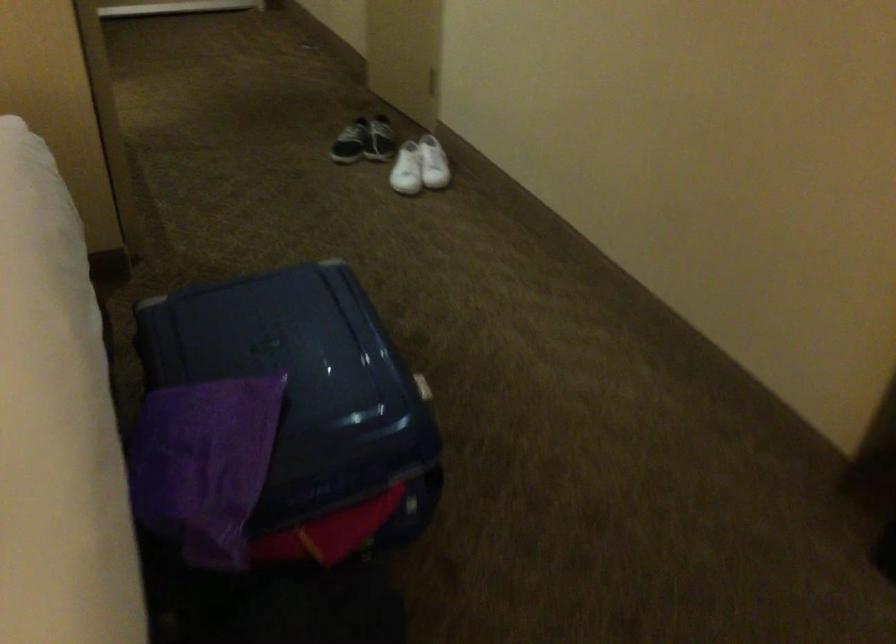
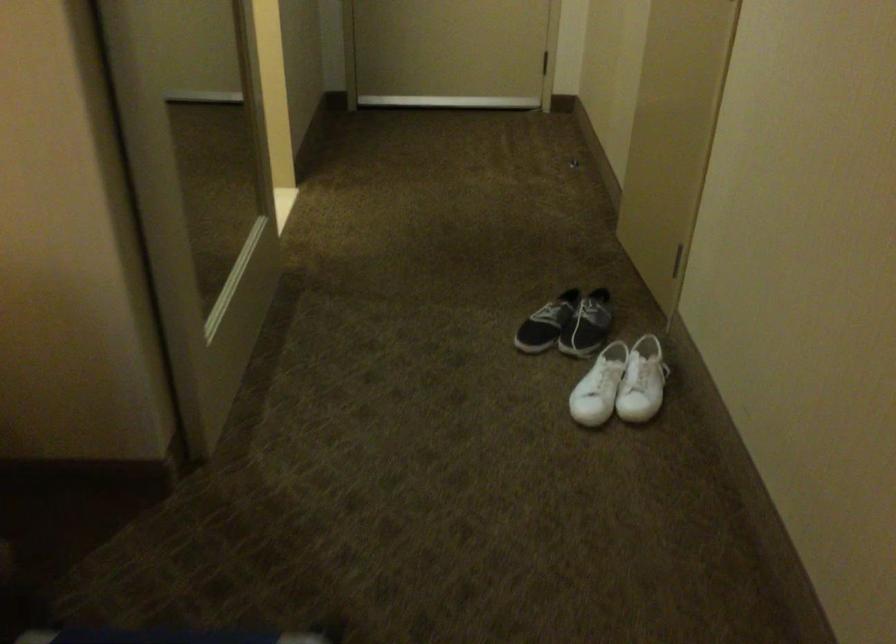
The point at [366,140] is marked in the first image. Where is the corresponding point in the second image?

(567, 324)